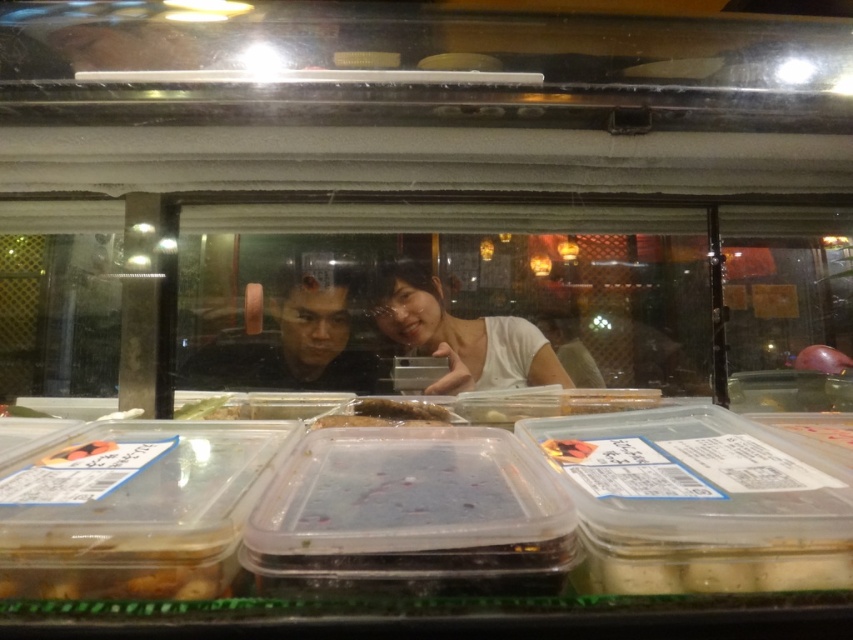
Question: Which point is closer to the camera?

Choices:
 (A) pink glossy plum at upper right
 (B) white matte shirt at center

Answer: (B)

Question: Can you confirm if translucent plastic fish at center is positioned to the right of green leafy vegetable at center?

Choices:
 (A) no
 (B) yes

Answer: (B)

Question: Where is matte white shirt at center located in relation to matte black face at center in the image?

Choices:
 (A) above
 (B) below

Answer: (A)

Question: Which point is farther from the camera taking this photo?

Choices:
 (A) (202, 355)
 (B) (68, 456)
 (C) (392, 317)

Answer: (A)

Question: Does matte white shirt at center have a larger size compared to pink glossy plum at upper right?

Choices:
 (A) no
 (B) yes

Answer: (B)

Question: Which object appears closest to the camera in this image?

Choices:
 (A) white matte shirt at center
 (B) matte white shirt at center

Answer: (A)